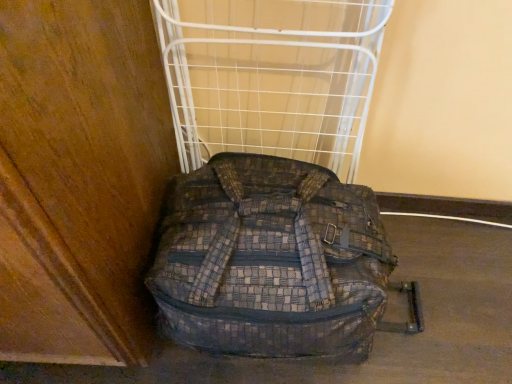
Question: Is point (159, 286) positioned closer to the camera than point (373, 23)?

Choices:
 (A) farther
 (B) closer

Answer: (A)

Question: Is plaid fabric backpack at center situated inside white wire rack at center or outside?

Choices:
 (A) outside
 (B) inside

Answer: (A)

Question: From the image's perspective, relative to white wire rack at center, is plaid fabric backpack at center above or below?

Choices:
 (A) below
 (B) above

Answer: (A)

Question: In the image, is white wire rack at center positioned in front of or behind plaid fabric backpack at center?

Choices:
 (A) behind
 (B) front

Answer: (A)

Question: Considering the positions of white wire rack at center and plaid fabric backpack at center in the image, is white wire rack at center wider or thinner than plaid fabric backpack at center?

Choices:
 (A) thin
 (B) wide

Answer: (A)

Question: Visually, is white wire rack at center positioned to the left or to the right of plaid fabric backpack at center?

Choices:
 (A) left
 (B) right

Answer: (A)

Question: Considering the positions of point (224, 79) and point (163, 279), is point (224, 79) closer or farther from the camera than point (163, 279)?

Choices:
 (A) farther
 (B) closer

Answer: (A)